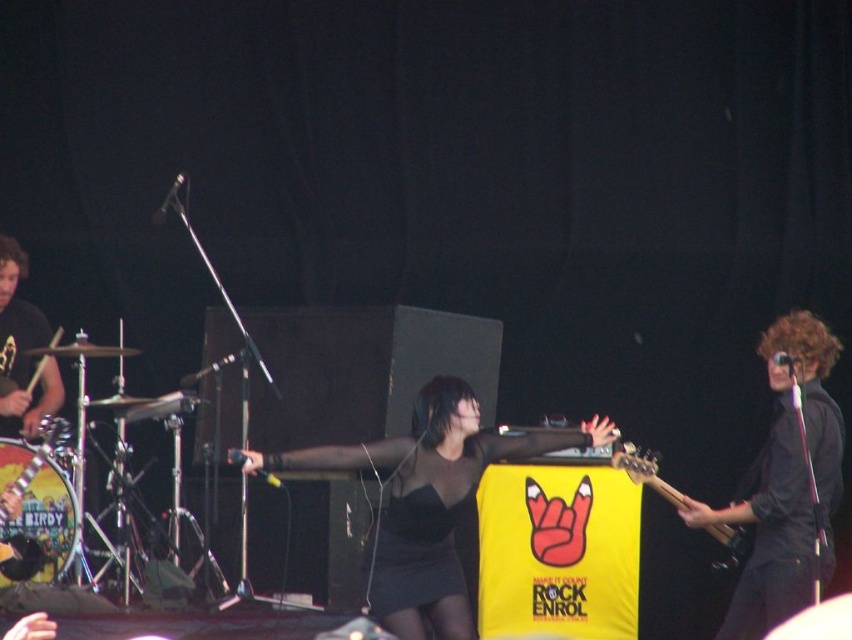
You are a photographer at the concert. You want to capture a photo that includes both the brushed metal drum at lower left and the wooden electric guitar at center. Based on their positions, which object should appear closer to the front of the photo?

The brushed metal drum at lower left should appear closer to the front of the photo because the wooden electric guitar at center is behind it.

You are a photographer at the concert and want to capture a photo where both the black matte dress at center and the black matte guitar at right are clearly visible. Based on their positions, which object will appear closer to the camera in the photo?

The black matte dress at center will appear closer to the camera because it is further to the viewer than the black matte guitar at right.

You are a photographer at the concert and want to capture the black matte dress at center. Given that your camera is focused on the point at coordinates point (429, 500), will this point be within the frame of the dress?

Yes, the point (429, 500) corresponds to the black matte dress at center, so the point is within the frame of the dress.